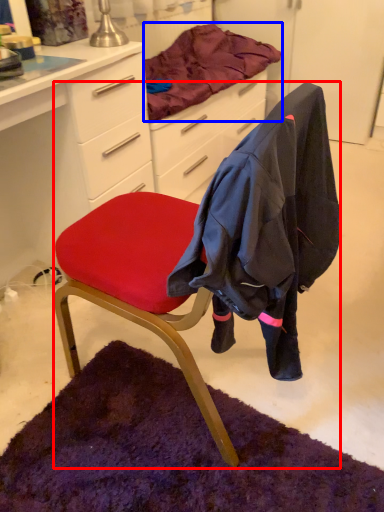
Question: Among these objects, which one is farthest to the camera, chair (highlighted by a red box) or blanket (highlighted by a blue box)?

Choices:
 (A) chair
 (B) blanket

Answer: (B)